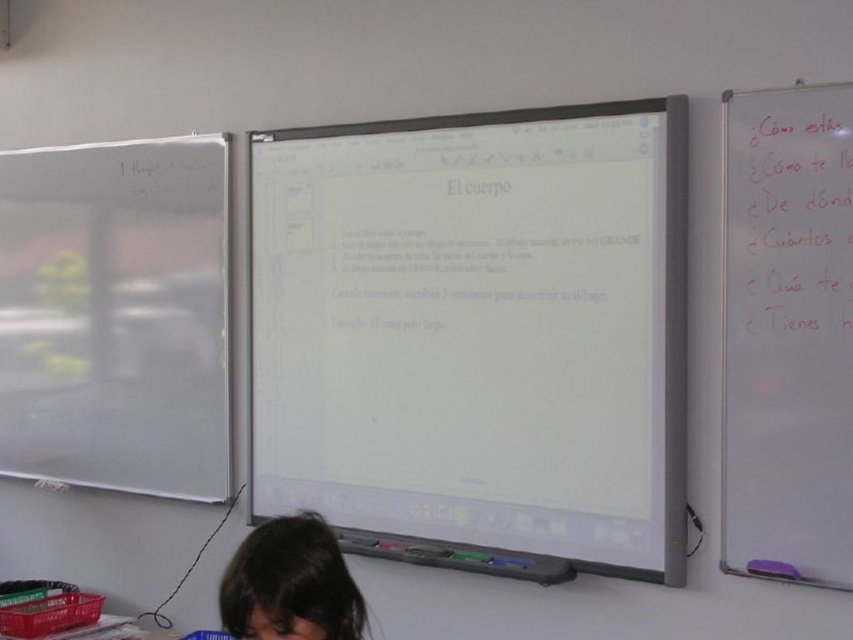
You are a student sitting at the back of the classroom. You want to see the white glossy projector screen at center clearly. Considering the screen is 6.86 feet away from you, is this distance within a comfortable viewing range for reading the text on the screen?

The white glossy projector screen at center is 6.86 feet away from the viewer. This distance is likely too close for comfortable reading, as typical comfortable viewing distances for screens are generally between 1.8 to 2.5 times the screen diagonal. However, since the exact screen size isn not provided, it is hard to determine precisely, but 6.86 feet may be considered close for most standard screen sizes used in classrooms.